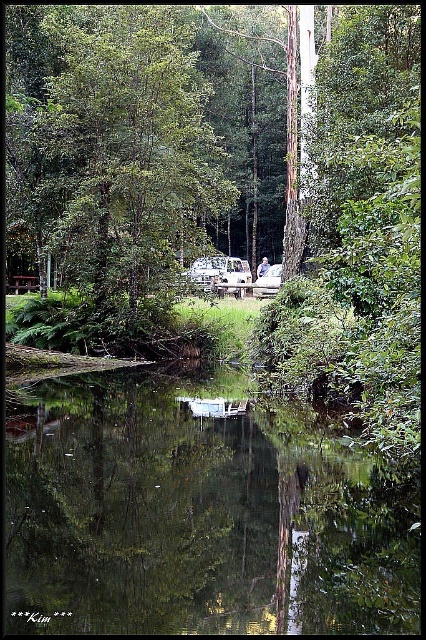
Question: Does green reflective water at center appear under white plastic camper van at center?

Choices:
 (A) yes
 (B) no

Answer: (A)

Question: Which of the following is the farthest from the observer?

Choices:
 (A) green leafy tree at center
 (B) white plastic camper van at center

Answer: (B)

Question: Is green leafy tree at center behind white plastic camper van at center?

Choices:
 (A) yes
 (B) no

Answer: (B)

Question: Which of the following is the closest to the observer?

Choices:
 (A) (230, 273)
 (B) (198, 150)
 (C) (397, 625)

Answer: (C)

Question: Can you confirm if green leafy tree at center is positioned to the right of white plastic camper van at center?

Choices:
 (A) yes
 (B) no

Answer: (B)

Question: Estimate the real-world distances between objects in this image. Which object is farther from the white plastic camper van at center?

Choices:
 (A) green reflective water at center
 (B) green leafy tree at center

Answer: (A)